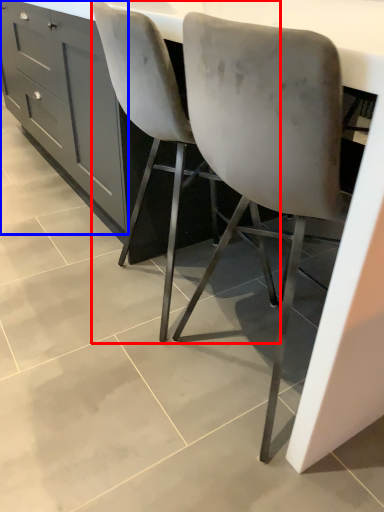
Question: Among these objects, which one is farthest to the camera, chair (highlighted by a red box) or cabinetry (highlighted by a blue box)?

Choices:
 (A) chair
 (B) cabinetry

Answer: (B)